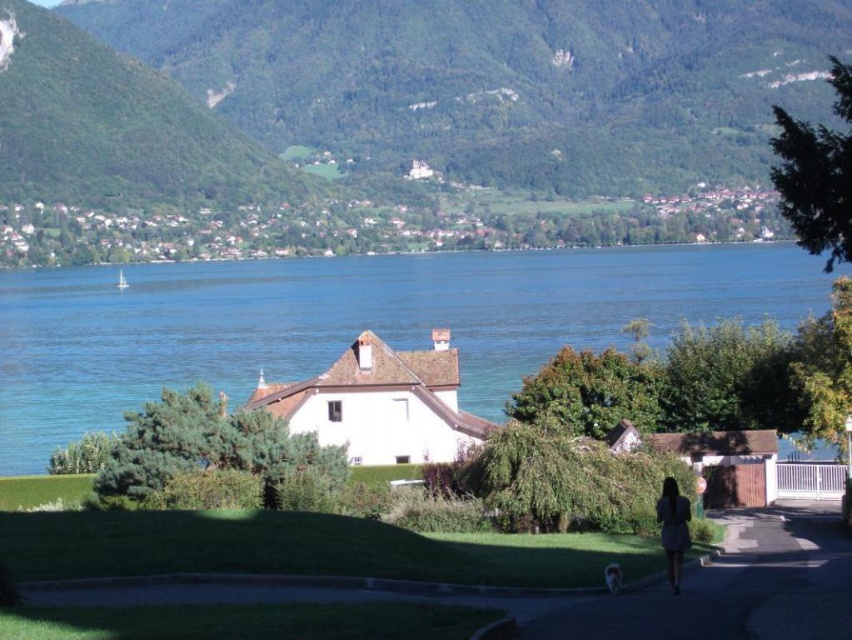
Question: Does dark green asphalt at lower center appear on the left side of blue dress at lower right?

Choices:
 (A) yes
 (B) no

Answer: (B)

Question: Considering the relative positions of green leafy mountain at upper center and blue dress at lower right in the image provided, where is green leafy mountain at upper center located with respect to blue dress at lower right?

Choices:
 (A) above
 (B) below

Answer: (A)

Question: Which of these objects is positioned farthest from the dark green asphalt at lower center?

Choices:
 (A) green leafy mountain at upper center
 (B) blue dress at lower right

Answer: (A)

Question: Which object is farther from the camera taking this photo?

Choices:
 (A) blue water at center
 (B) blue dress at lower right
 (C) dark green asphalt at lower center

Answer: (B)

Question: Based on their relative distances, which object is farther from the dark green asphalt at lower center?

Choices:
 (A) blue dress at lower right
 (B) green leafy mountain at upper center
 (C) blue water at center

Answer: (B)

Question: Does blue water at center appear under dark green asphalt at lower center?

Choices:
 (A) yes
 (B) no

Answer: (B)